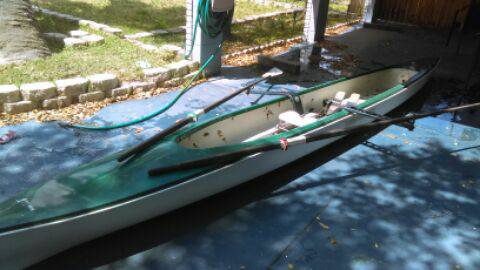
Image resolution: width=480 pixels, height=270 pixels. I want to click on blue floor, so click(225, 236).